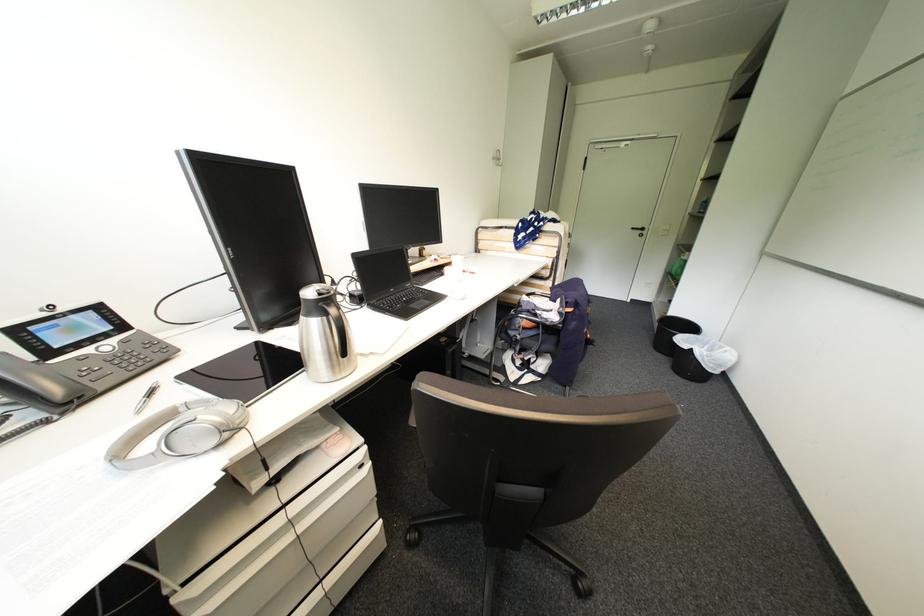
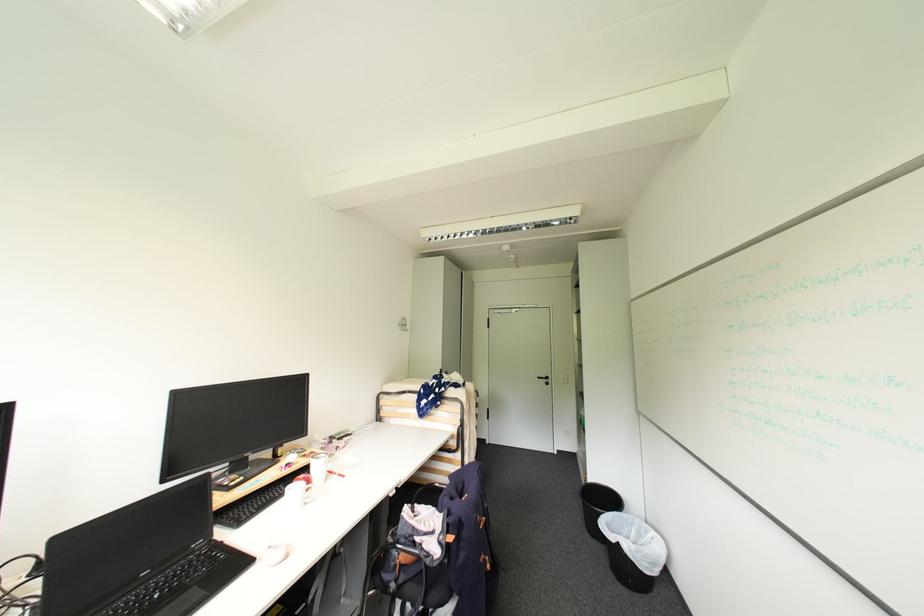
Locate, in the second image, the point that corresponds to point 455,298 in the first image.

(263, 562)